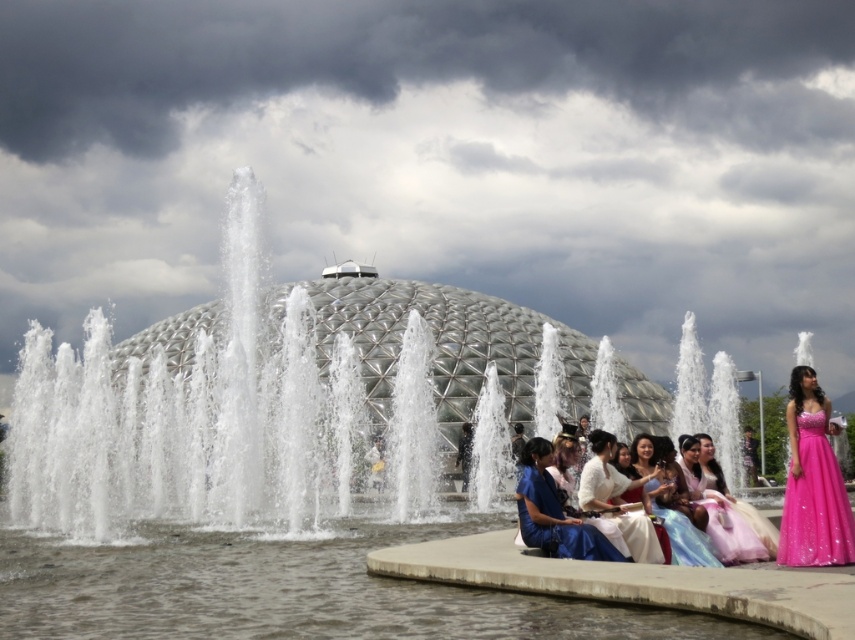
Question: Which point is farther from the camera taking this photo?

Choices:
 (A) (809, 499)
 (B) (597, 497)
 (C) (158, 387)
 (D) (765, 525)

Answer: (C)

Question: Is white frothy water at center smaller than blue satin dress at center?

Choices:
 (A) no
 (B) yes

Answer: (A)

Question: Does pink sequined dress at right appear on the right side of blue satin dress at center?

Choices:
 (A) no
 (B) yes

Answer: (B)

Question: Among these points, which one is farthest from the camera?

Choices:
 (A) (655, 497)
 (B) (234, 198)
 (C) (823, 476)
 (D) (740, 520)

Answer: (B)

Question: Is the position of white frothy water at center less distant than that of blue satin dress at center?

Choices:
 (A) yes
 (B) no

Answer: (A)

Question: Which point is farther to the camera?

Choices:
 (A) (145, 412)
 (B) (706, 492)
 (C) (610, 465)
 (D) (576, 540)

Answer: (A)